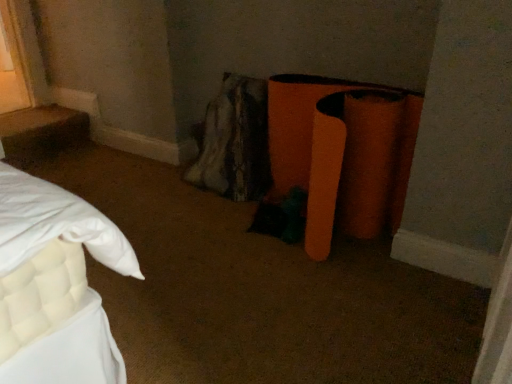
Question: Should I look upward or downward to see orange matte stool at lower right?

Choices:
 (A) down
 (B) up

Answer: (B)